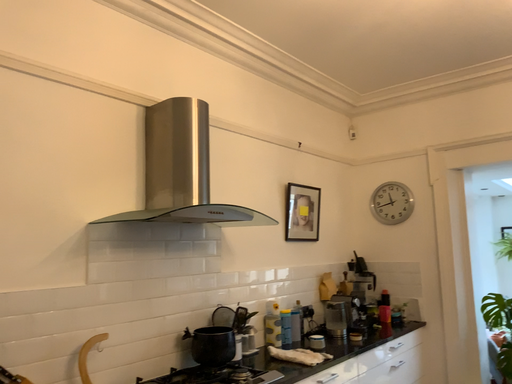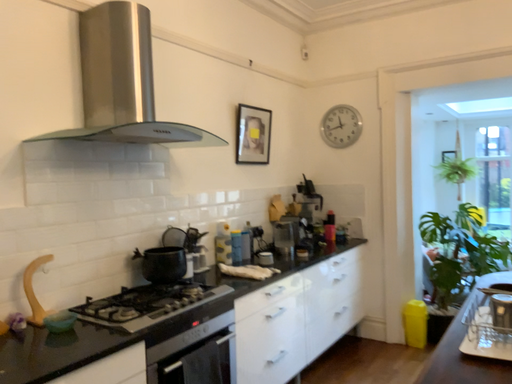
Question: How did the camera likely rotate when shooting the video?

Choices:
 (A) rotated left
 (B) rotated right

Answer: (B)